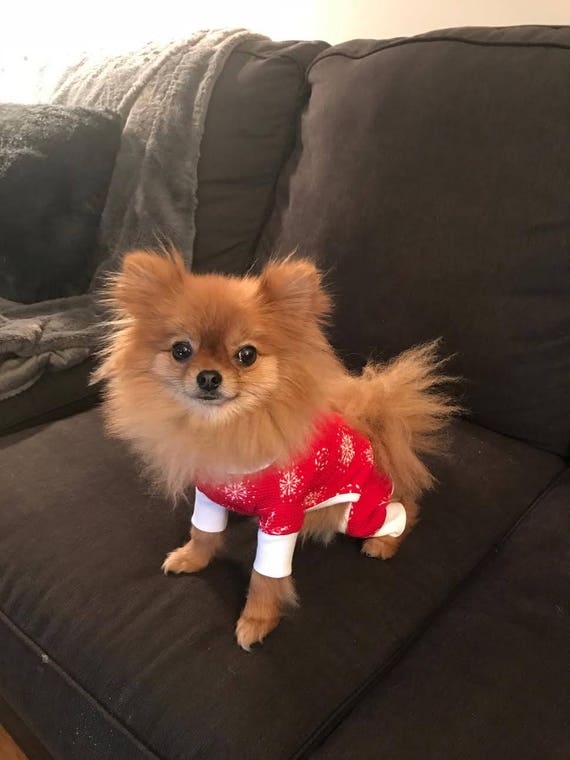
Find the location of a particular element. dog sitting on couch is located at coordinates (310, 467).